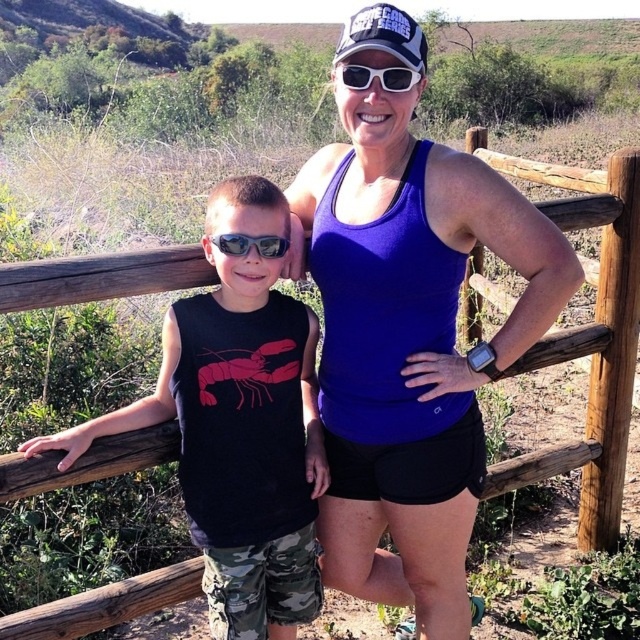
Describe the element at coordinates (408, 330) in the screenshot. The height and width of the screenshot is (640, 640). I see `purple fabric tank top at center` at that location.

Who is positioned more to the right, purple fabric tank top at center or sunglasses at center?

Positioned to the right is purple fabric tank top at center.

Between point (408, 577) and point (348, 81), which one is positioned behind?

The point (408, 577) is more distant.

You are a GUI agent. You are given a task and a screenshot of the screen. Output one action in this format:
    pyautogui.click(x=<x>, y=<y>)
    Task: Click on the purple fabric tank top at center
    This screenshot has height=640, width=640.
    Given the screenshot: What is the action you would take?
    pyautogui.click(x=408, y=330)

Is point (317, 582) positioned in front of point (390, 84)?

No.

Does black cotton shirt at left have a greater height compared to sunglasses at center?

Yes.

Is point (173, 305) less distant than point (417, 72)?

No, it is behind (417, 72).

Identify the location of black cotton shirt at left. The image size is (640, 640). (237, 426).

Who is lower down, purple fabric tank top at center or black cotton shirt at left?

black cotton shirt at left is below.

Is point (364, 451) in front of point (252, 522)?

No, it is not.

Is point (452, 388) farther from camera compared to point (234, 636)?

No.

Where is `purple fabric tank top at center`? The image size is (640, 640). purple fabric tank top at center is located at coordinates (408, 330).